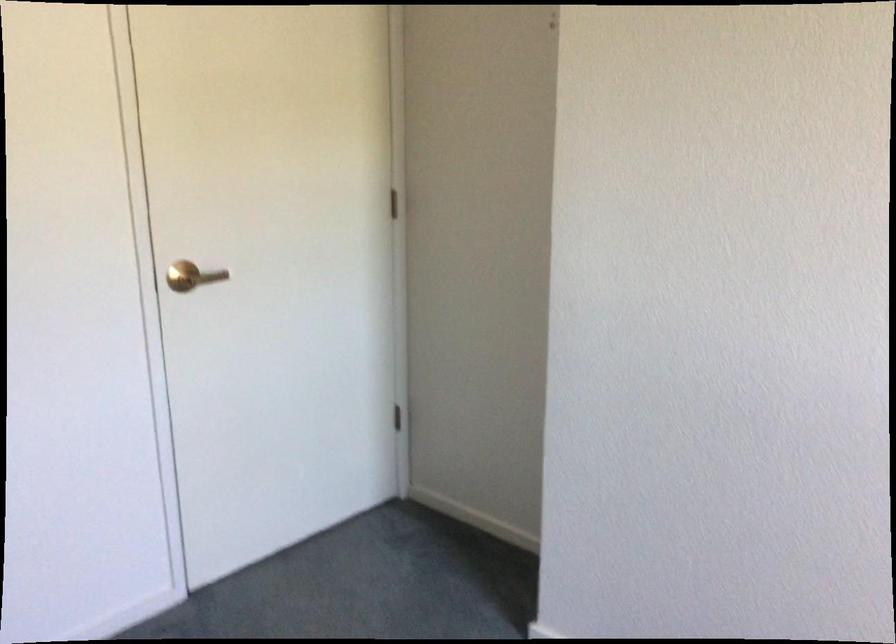
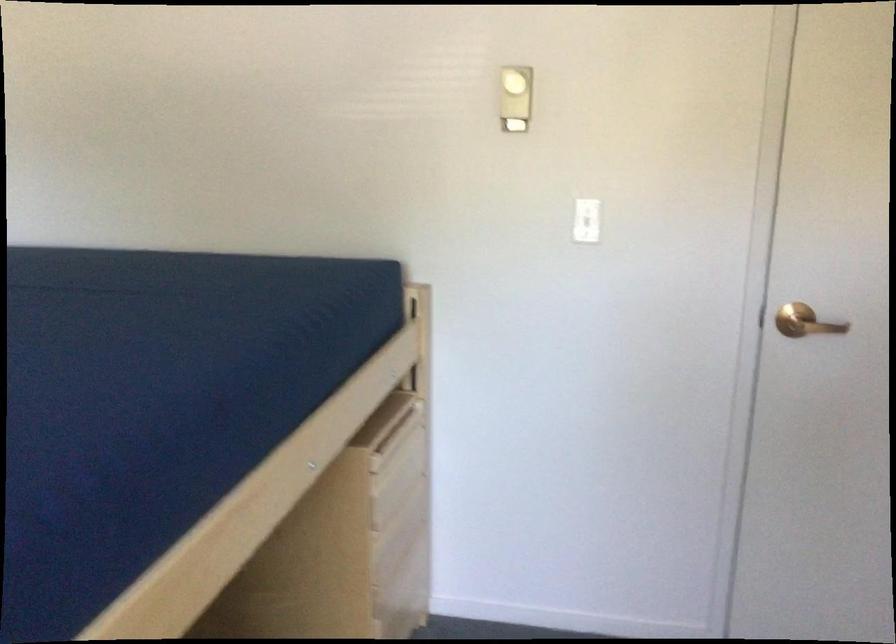
In the second image, find the point that corresponds to pixel 194 272 in the first image.

(805, 322)